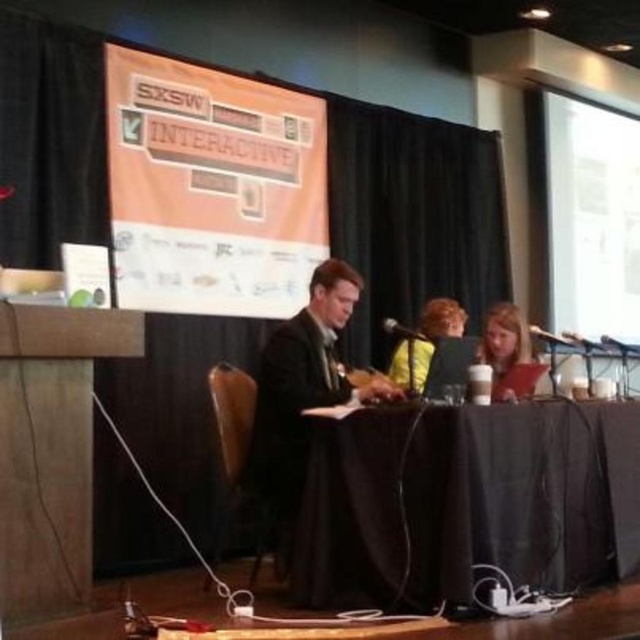
Question: Which of the following is the farthest from the observer?

Choices:
 (A) (x=557, y=120)
 (B) (x=404, y=328)
 (C) (x=262, y=168)
 (D) (x=477, y=349)

Answer: (A)

Question: Which of the following is the farthest from the observer?

Choices:
 (A) blonde hair at center
 (B) yellow fabric jacket at center
 (C) white matte projection screen at upper right

Answer: (C)

Question: Does matte black suit at center appear on the left side of blonde hair at center?

Choices:
 (A) no
 (B) yes

Answer: (B)

Question: Which object is farther from the camera taking this photo?

Choices:
 (A) black plastic microphone at center
 (B) white matte projection screen at upper right
 (C) black fabric table at center

Answer: (B)

Question: Can you confirm if white matte projection screen at upper right is positioned to the left of black plastic microphone at center?

Choices:
 (A) yes
 (B) no

Answer: (B)

Question: Can you confirm if black fabric table at center is wider than matte black suit at center?

Choices:
 (A) yes
 (B) no

Answer: (A)